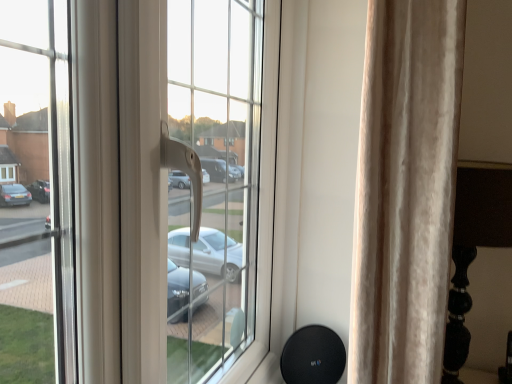
Question: Should I look upward or downward to see beige velvet curtain at right?

Choices:
 (A) down
 (B) up

Answer: (A)